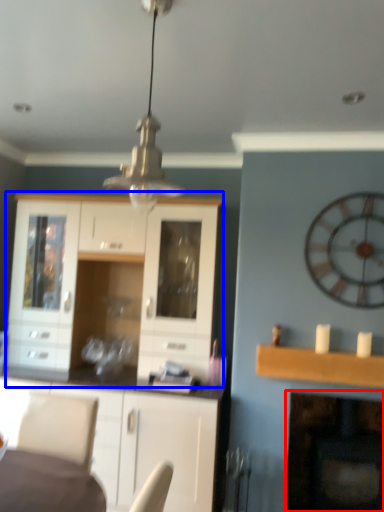
Question: Which object is further to the camera taking this photo, fireplace (highlighted by a red box) or cabinetry (highlighted by a blue box)?

Choices:
 (A) fireplace
 (B) cabinetry

Answer: (A)